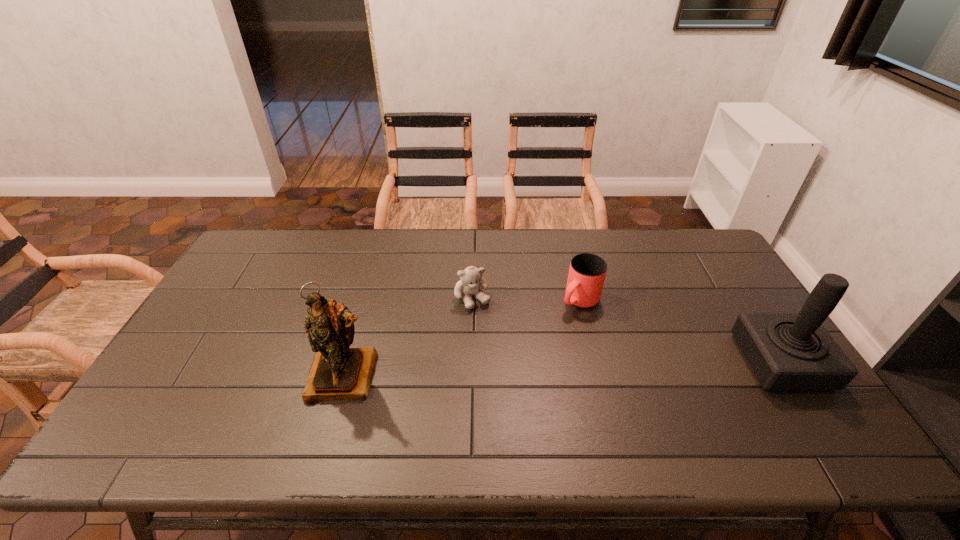
Locate an element on the screen. This screenshot has height=540, width=960. figurine present at the near edge is located at coordinates (338, 372).

This screenshot has height=540, width=960. I want to click on joystick situated at the near edge, so click(786, 350).

The image size is (960, 540). I want to click on object at the right edge, so click(x=786, y=350).

You are a GUI agent. You are given a task and a screenshot of the screen. Output one action in this format:
    pyautogui.click(x=<x>, y=<y>)
    Task: Click on the object that is at the near right corner
    
    Given the screenshot: What is the action you would take?
    pyautogui.click(x=786, y=350)

Identify the location of free region at the far edge of the desktop. This screenshot has width=960, height=540. (598, 244).

In the image, there is a desktop. At what (x,y) coordinates should I click in order to perform the action: click on vacant region at the near edge. Please return your answer as a coordinate pair (x, y). This screenshot has height=540, width=960. Looking at the image, I should click on (528, 391).

The image size is (960, 540). In order to click on vacant space at the left edge of the desktop in this screenshot , I will do `click(209, 366)`.

The image size is (960, 540). Identify the location of free region at the right edge of the desktop. (726, 298).

Locate an element on the screen. vacant area at the far left corner of the desktop is located at coordinates pyautogui.click(x=268, y=228).

The width and height of the screenshot is (960, 540). In the image, there is a desktop. What are the coordinates of `vacant space at the near left corner` in the screenshot? It's located at (167, 415).